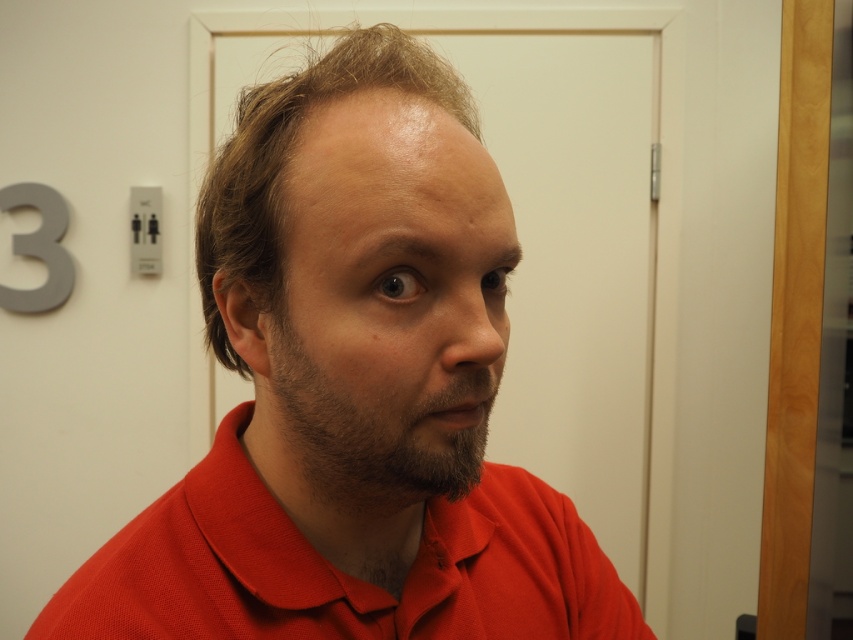
You are designing a new fashion line and want to ensure that the red matte shirt at center and the brown fuzzy beard at center are proportionate. Which object should you adjust in size to achieve a balanced look?

The red matte shirt at center is bigger than the brown fuzzy beard at center. To achieve a balanced look, you should reduce the size of the red matte shirt at center or increase the size of the brown fuzzy beard at center.

You are a tailor measuring a mannequin wearing the red matte shirt at center and brown fuzzy beard at center. The minimum safe distance between the shirt and beard for a comfortable fit is 2.5 inches. Is the current distance sufficient?

The red matte shirt at center is 2.49 inches from brown fuzzy beard at center, which is just below the 2.5 inches minimum safe distance. Therefore, the current distance is insufficient for a comfortable fit.